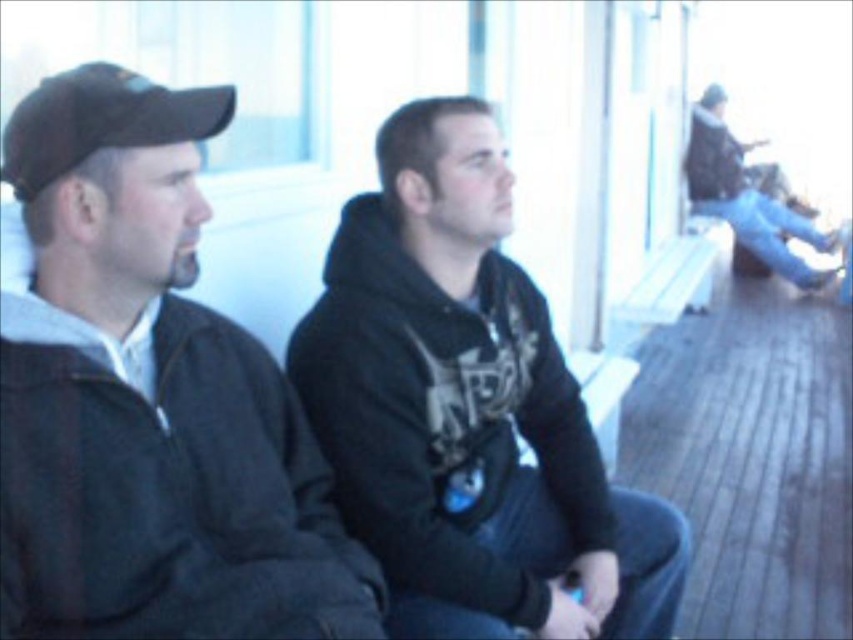
Does black matte hoodie at center have a larger size compared to dark gray hoodie at upper right?

Incorrect, black matte hoodie at center is not larger than dark gray hoodie at upper right.

Can you confirm if black matte hoodie at center is positioned to the right of dark gray hoodie at upper right?

Incorrect, black matte hoodie at center is not on the right side of dark gray hoodie at upper right.

Who is more forward, (645, 500) or (723, 115)?

Point (645, 500)

Where is `black matte hoodie at center`? black matte hoodie at center is located at coordinates (467, 410).

Does black matte hoodie at center appear over black matte baseball cap at left?

No, black matte hoodie at center is not above black matte baseball cap at left.

Does black matte hoodie at center have a greater width compared to black matte baseball cap at left?

Yes.

This screenshot has width=853, height=640. Describe the element at coordinates (467, 410) in the screenshot. I see `black matte hoodie at center` at that location.

Locate an element on the screen. black matte hoodie at center is located at coordinates (467, 410).

Is point (306, 595) positioned behind point (793, 225)?

No, it is not.

Which is in front, point (164, 352) or point (796, 264)?

Point (164, 352) is in front.

Measure the distance between point (x=144, y=148) and camera.

Point (x=144, y=148) is 1.21 meters away from camera.

Find the location of a particular element. dark gray jacket at left is located at coordinates (149, 397).